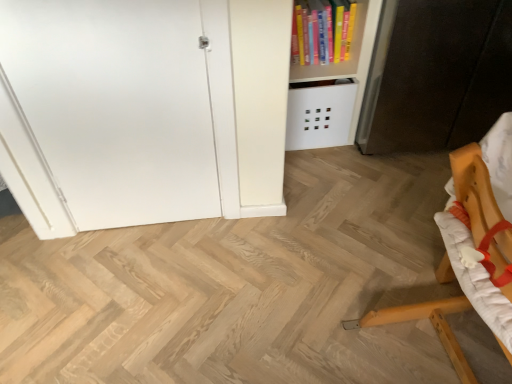
This screenshot has height=384, width=512. I want to click on free space to the left of white matte door at left, so click(63, 253).